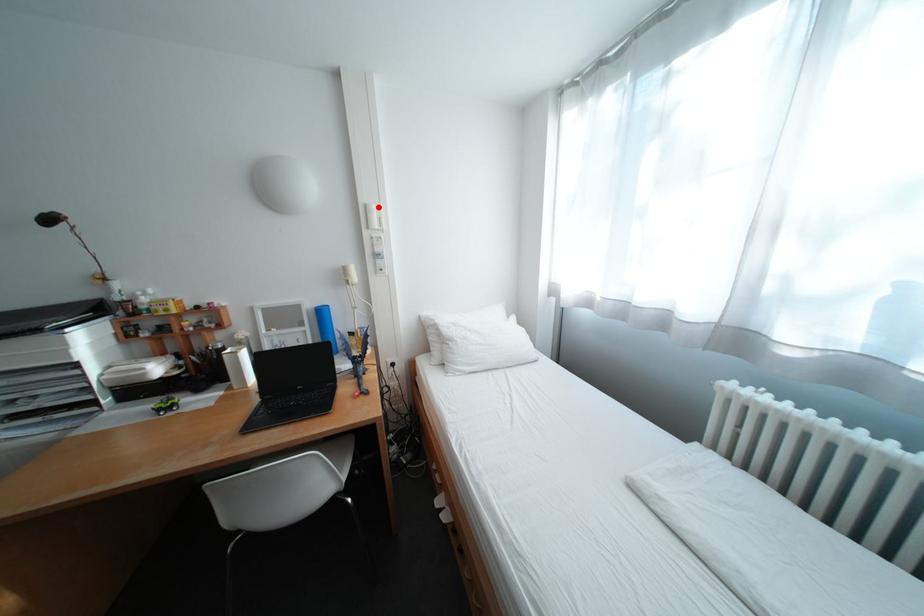
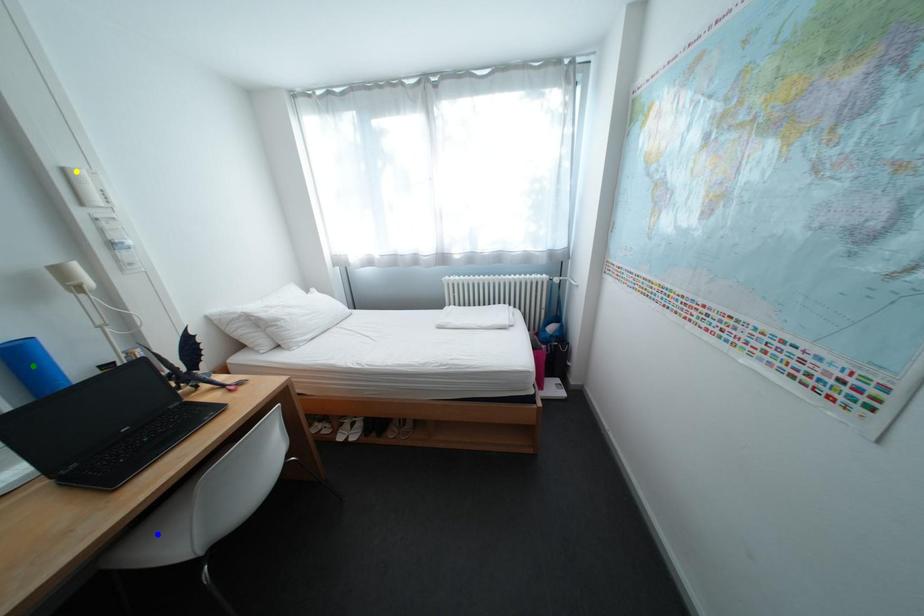
Question: I am providing you with two images of the same scene from different viewpoints. A red point is marked on the first image. You are given multiple points on the second image. Can you choose the point in image 2 that corresponds to the point in image 1?

Choices:
 (A) yellow point
 (B) green point
 (C) blue point

Answer: (A)